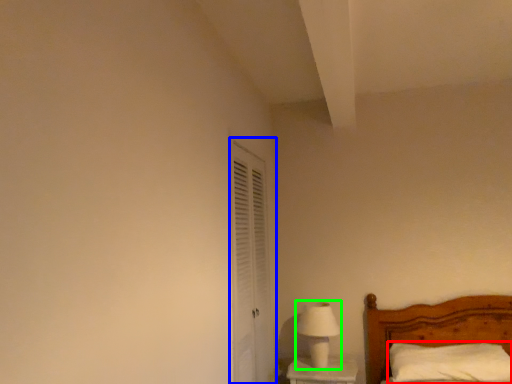
Question: Which object is positioned closest to pillow (highlighted by a red box)? Select from screen door (highlighted by a blue box) and table lamp (highlighted by a green box).

Choices:
 (A) screen door
 (B) table lamp

Answer: (B)